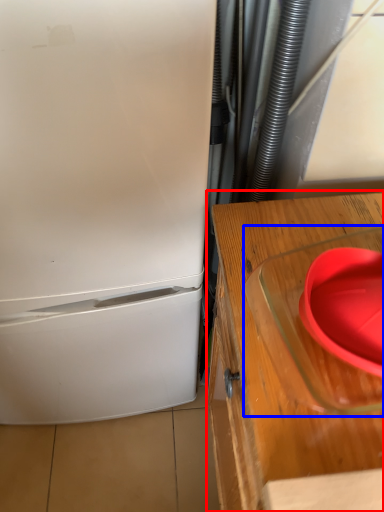
Question: Which object is closer to the camera taking this photo, table (highlighted by a red box) or appliance (highlighted by a blue box)?

Choices:
 (A) table
 (B) appliance

Answer: (B)